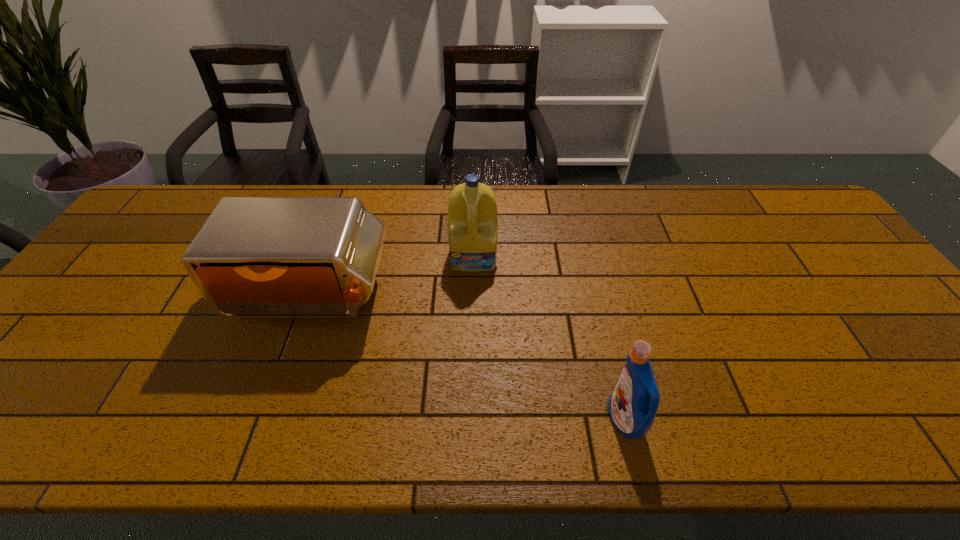
Identify the location of empty space between the nearest object and the left detergent. (549, 338).

This screenshot has height=540, width=960. Identify the location of empty location between the nearest object and the leftmost object. (468, 358).

Where is `vacant space in between the toaster oven and the shorter detergent`? This screenshot has height=540, width=960. vacant space in between the toaster oven and the shorter detergent is located at coordinates (468, 358).

This screenshot has width=960, height=540. What are the coordinates of `empty space between the nearer detergent and the toaster oven` in the screenshot? It's located at (468, 358).

I want to click on unoccupied position between the second object from left to right and the toaster oven, so click(393, 276).

This screenshot has height=540, width=960. Find the location of `free area in between the shorter detergent and the taller detergent`. free area in between the shorter detergent and the taller detergent is located at coordinates (549, 338).

Image resolution: width=960 pixels, height=540 pixels. Find the location of `the closest object to the nearer detergent`. the closest object to the nearer detergent is located at coordinates (472, 211).

You are a GUI agent. You are given a task and a screenshot of the screen. Output one action in this format:
    pyautogui.click(x=<x>, y=<y>)
    Task: Click on the object that is the closest to the taller detergent
    
    Given the screenshot: What is the action you would take?
    pyautogui.click(x=255, y=257)